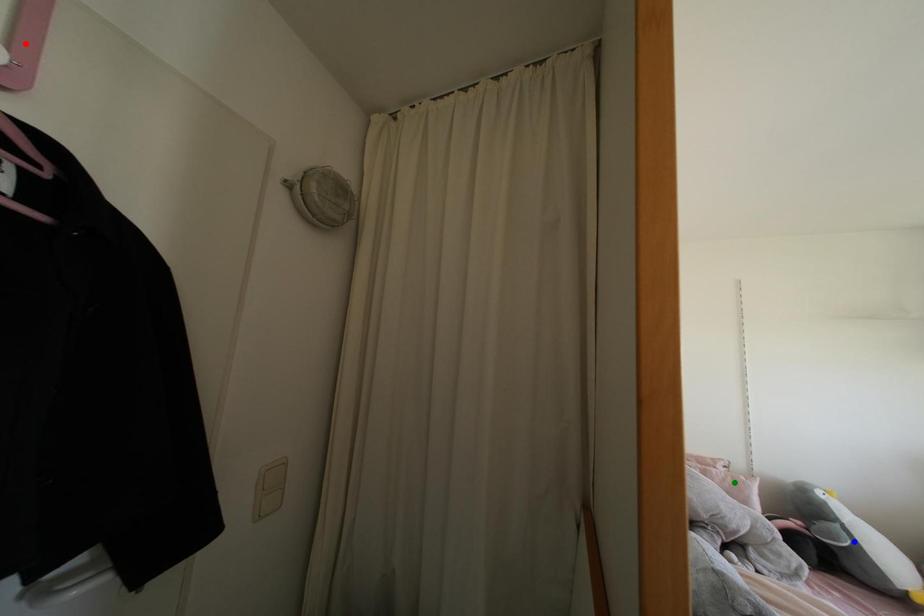
Consider the image. Order these from nearest to farthest:
- blue point
- red point
- green point

red point → blue point → green point